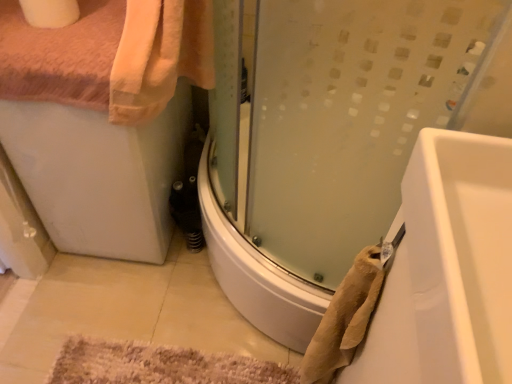
Question: Considering the relative sizes of beige textured bath mat at lower center and white matte toilet paper at upper left in the image provided, is beige textured bath mat at lower center wider than white matte toilet paper at upper left?

Choices:
 (A) yes
 (B) no

Answer: (A)

Question: From the image's perspective, is beige textured bath mat at lower center located above white matte toilet paper at upper left?

Choices:
 (A) no
 (B) yes

Answer: (A)

Question: Can you confirm if beige textured bath mat at lower center is positioned to the right of white matte toilet paper at upper left?

Choices:
 (A) no
 (B) yes

Answer: (B)

Question: Is beige textured bath mat at lower center completely or partially outside of white matte toilet paper at upper left?

Choices:
 (A) no
 (B) yes

Answer: (B)

Question: Is white matte toilet paper at upper left at the back of beige textured bath mat at lower center?

Choices:
 (A) yes
 (B) no

Answer: (B)

Question: Relative to beige textured bath mat at lower center, is white glossy bathtub at lower right in front or behind?

Choices:
 (A) front
 (B) behind

Answer: (A)

Question: Is white glossy bathtub at lower right to the left or to the right of beige textured bath mat at lower center in the image?

Choices:
 (A) left
 (B) right

Answer: (B)

Question: Is white glossy bathtub at lower right wider or thinner than beige textured bath mat at lower center?

Choices:
 (A) wide
 (B) thin

Answer: (B)

Question: From the image's perspective, is white glossy bathtub at lower right positioned above or below beige textured bath mat at lower center?

Choices:
 (A) above
 (B) below

Answer: (A)

Question: In terms of width, does satin glass shower door at center look wider or thinner when compared to white matte toilet paper at upper left?

Choices:
 (A) thin
 (B) wide

Answer: (B)

Question: From a real-world perspective, is satin glass shower door at center physically located above or below white matte toilet paper at upper left?

Choices:
 (A) below
 (B) above

Answer: (A)

Question: Is satin glass shower door at center to the left or to the right of white matte toilet paper at upper left in the image?

Choices:
 (A) right
 (B) left

Answer: (A)

Question: Would you say satin glass shower door at center is inside or outside white matte toilet paper at upper left?

Choices:
 (A) inside
 (B) outside

Answer: (B)

Question: From the image's perspective, is white glossy bathtub at lower right above or below satin glass shower door at center?

Choices:
 (A) above
 (B) below

Answer: (B)

Question: From a real-world perspective, is white glossy bathtub at lower right positioned above or below satin glass shower door at center?

Choices:
 (A) above
 (B) below

Answer: (B)